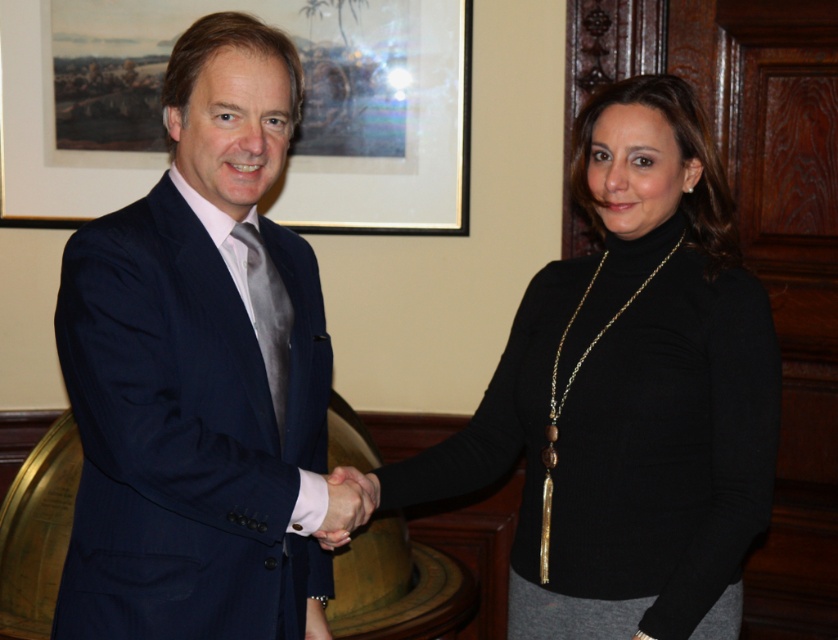
Question: Is black matte turtleneck at center behind white matte hand at center?

Choices:
 (A) no
 (B) yes

Answer: (B)

Question: Observing the image, what is the correct spatial positioning of black matte turtleneck at center in reference to white matte hand at center?

Choices:
 (A) above
 (B) below

Answer: (A)

Question: Which point is farther to the camera?

Choices:
 (A) wooden picture frame at upper center
 (B) black matte turtleneck at center
 (C) navy blue suit at center
 (D) white matte hand at center

Answer: (A)

Question: Which of these objects is positioned closest to the white matte hand at center?

Choices:
 (A) wooden picture frame at upper center
 (B) black matte turtleneck at center

Answer: (B)

Question: Which of these objects is positioned farthest from the wooden picture frame at upper center?

Choices:
 (A) white matte hand at center
 (B) navy blue suit at center

Answer: (A)

Question: Does navy blue suit at center have a larger size compared to wooden picture frame at upper center?

Choices:
 (A) yes
 (B) no

Answer: (B)